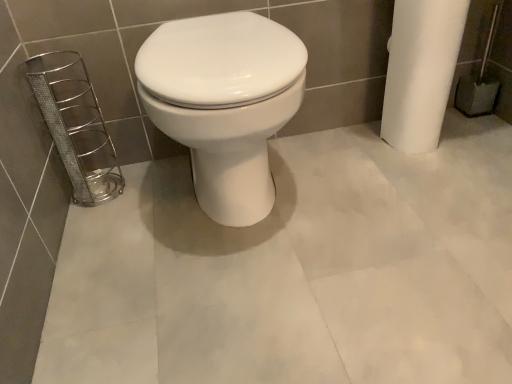
I want to click on vacant space to the left of white glossy toilet at center, so click(x=120, y=220).